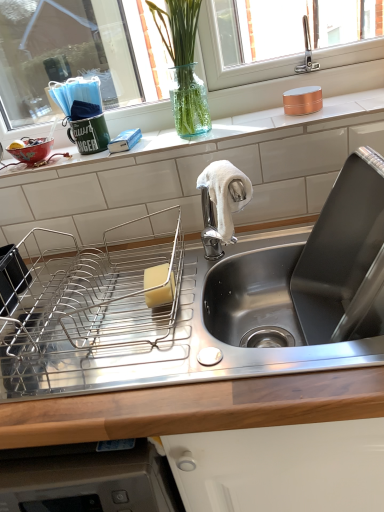
At what (x,y) coordinates should I click in order to perform the action: click on vacant space to the right of yellow sponge at sink. Please return your answer as a coordinate pair (x, y). The height and width of the screenshot is (512, 384). Looking at the image, I should click on (207, 271).